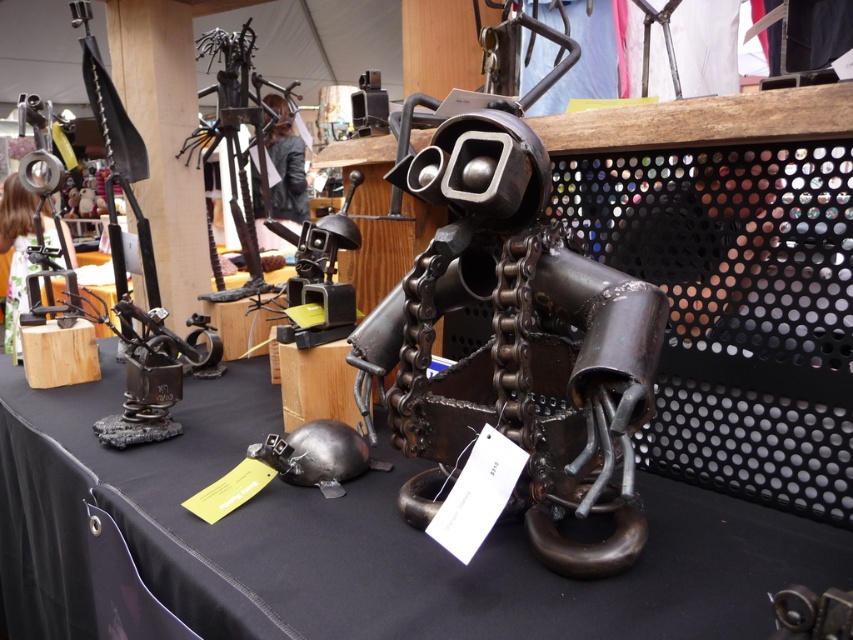
Looking at this image, measure the distance between black matte tablecloth at center and camera.

They are 69.90 centimeters apart.

Between point (196, 387) and point (403, 344), which one is positioned behind?

Positioned behind is point (196, 387).

In order to click on black matte tablecloth at center in this screenshot , I will do [x=349, y=538].